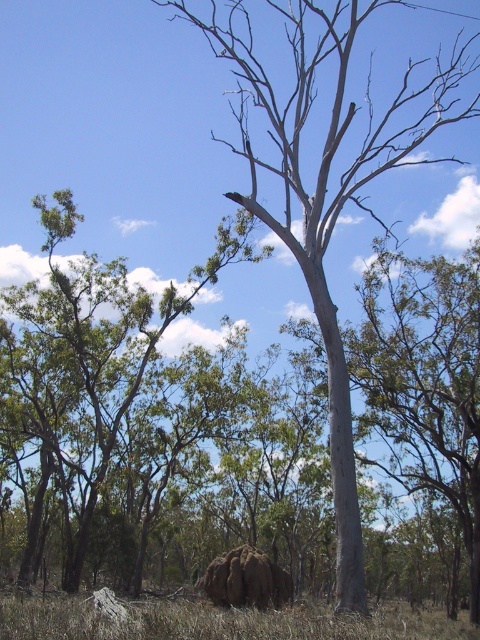
Question: Among these objects, which one is nearest to the camera?

Choices:
 (A) gray bark tree at center
 (B) brown dry grass at lower center
 (C) smooth grey tree trunk at center

Answer: (B)

Question: Does smooth grey tree trunk at center appear on the right side of brown dry grass at lower center?

Choices:
 (A) no
 (B) yes

Answer: (B)

Question: Does gray bark tree at center appear under brown dry grass at lower center?

Choices:
 (A) no
 (B) yes

Answer: (A)

Question: Which is nearer to the brown dry grass at lower center?

Choices:
 (A) gray bark tree at center
 (B) smooth grey tree trunk at center

Answer: (B)

Question: Can you confirm if smooth grey tree trunk at center is positioned to the left of brown dry grass at lower center?

Choices:
 (A) yes
 (B) no

Answer: (B)

Question: Among these objects, which one is farthest from the camera?

Choices:
 (A) smooth grey tree trunk at center
 (B) green leafy tree at left
 (C) gray bark tree at center
 (D) brown dry grass at lower center

Answer: (B)